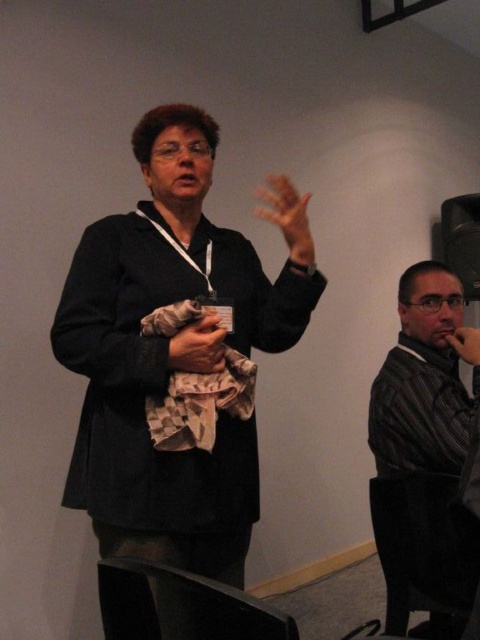
Between matte black jacket at center and smooth skin hand at right, which one has more height?

A: With more height is matte black jacket at center.

Does matte black jacket at center have a greater height compared to smooth skin hand at right?

Correct, matte black jacket at center is much taller as smooth skin hand at right.

Identify the location of matte black jacket at center. This screenshot has height=640, width=480. point(167,356).

Who is lower down, matte black hand at center or camouflage fabric hand at center?

camouflage fabric hand at center

Is matte black hand at center shorter than camouflage fabric hand at center?

No.

Which is in front, point (303, 259) or point (195, 328)?

Point (195, 328) is in front.

Where is `matte black hand at center`? This screenshot has width=480, height=640. matte black hand at center is located at coordinates (287, 216).

Is matte black jacket at center thinner than striped fabric shirt at right?

No, matte black jacket at center is not thinner than striped fabric shirt at right.

Which is in front, point (316, 276) or point (432, 408)?

Point (316, 276)

Between point (180, 528) and point (400, 372), which one is positioned behind?

The point (400, 372) is behind.

Identify the location of matte black jacket at center. Image resolution: width=480 pixels, height=640 pixels. (167, 356).